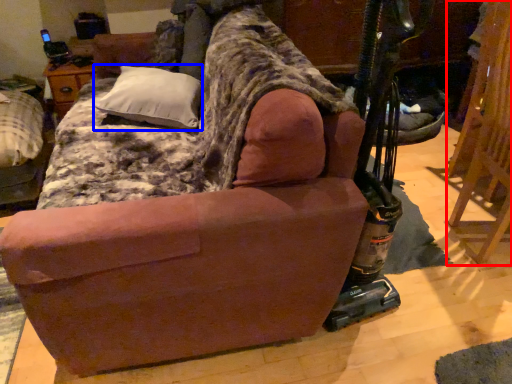
Question: Among these objects, which one is farthest to the camera, folding chair (highlighted by a red box) or pillow (highlighted by a blue box)?

Choices:
 (A) folding chair
 (B) pillow

Answer: (B)